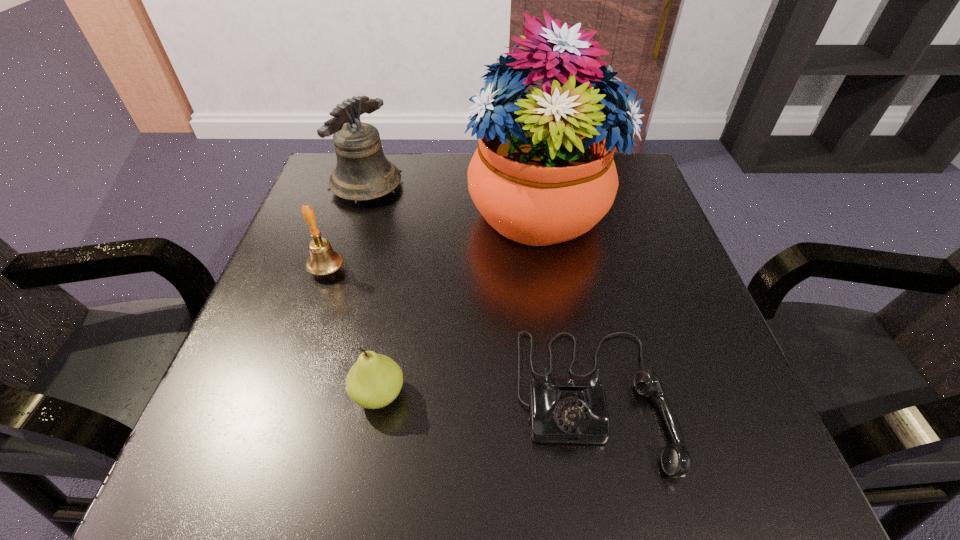
I want to click on vacant point located between the shortest object and the tallest object, so click(x=565, y=305).

Identify the location of empty space between the tallest object and the telephone. The height and width of the screenshot is (540, 960). (565, 305).

The width and height of the screenshot is (960, 540). Identify the location of free spot between the pear and the third shortest object. (353, 332).

I want to click on unoccupied area between the telephone and the fourth tallest object, so click(486, 397).

You are a GUI agent. You are given a task and a screenshot of the screen. Output one action in this format:
    pyautogui.click(x=<x>, y=<y>)
    Task: Click on the vacant region between the flower arrangement and the telephone
    
    Given the screenshot: What is the action you would take?
    pyautogui.click(x=565, y=305)

The height and width of the screenshot is (540, 960). Find the location of `free spot between the taller bell and the pear`. free spot between the taller bell and the pear is located at coordinates (372, 291).

Locate an element on the screen. object that stands as the fourth closest to the fourth shortest object is located at coordinates (562, 410).

I want to click on object that can be found as the third closest to the nearer bell, so click(543, 173).

This screenshot has width=960, height=540. What are the coordinates of `vacant position in the image that satisfies the following two spatial constraints: 1. on the front side of the farther bell; 2. on the left side of the flower arrangement` in the screenshot? It's located at (359, 211).